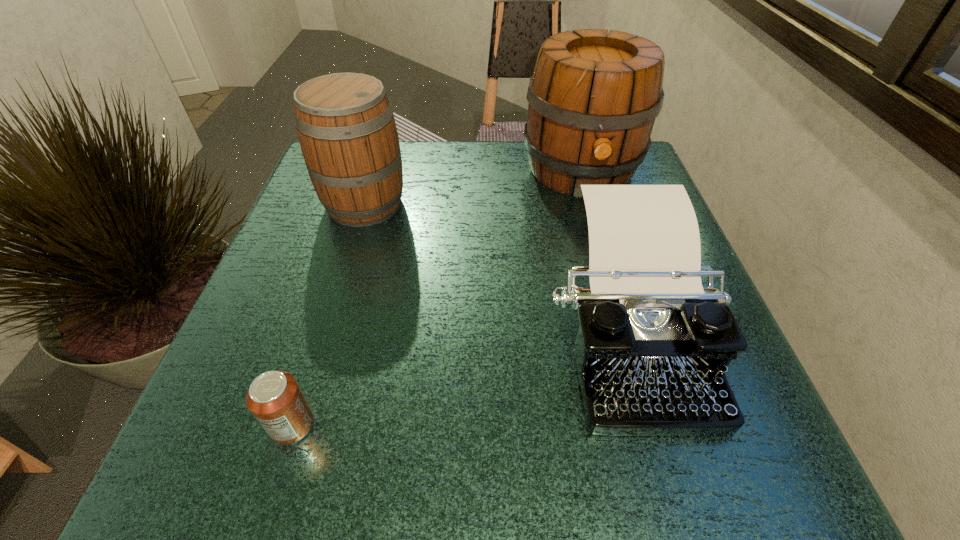
The height and width of the screenshot is (540, 960). I want to click on free space between the can and the left cider, so click(328, 314).

At what (x,y) coordinates should I click in order to perform the action: click on empty space between the can and the left cider. Please return your answer as a coordinate pair (x, y). Looking at the image, I should click on (328, 314).

Find the location of a particular element. The image size is (960, 540). vacant region between the second shortest object and the can is located at coordinates (460, 380).

Find the location of a particular element. free spot between the left cider and the can is located at coordinates (328, 314).

Where is `object that is the third nearest to the left cider`? This screenshot has height=540, width=960. object that is the third nearest to the left cider is located at coordinates (275, 399).

Locate an element on the screen. object that is the nearest to the left cider is located at coordinates (593, 98).

I want to click on vacant area in the image that satisfies the following two spatial constraints: 1. on the back side of the can; 2. on the left side of the left cider, so 361,204.